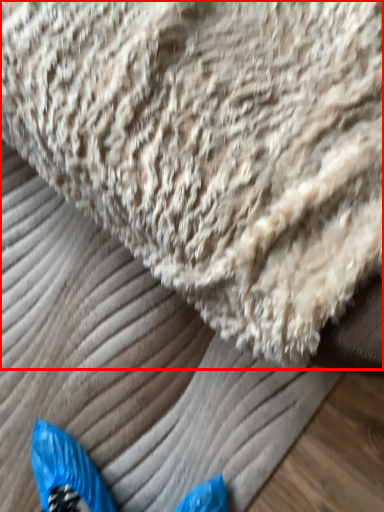
Question: From the image's perspective, what is the correct spatial relationship of towel (annotated by the red box) in relation to sheet?

Choices:
 (A) below
 (B) above

Answer: (B)